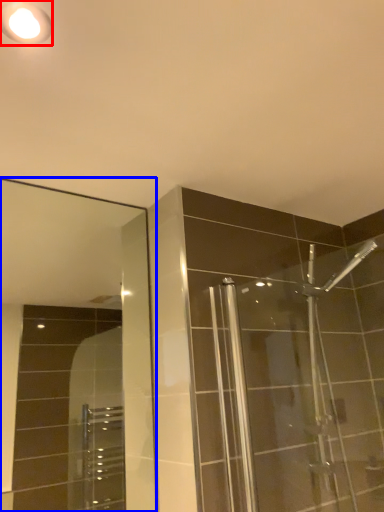
Question: Among these objects, which one is nearest to the camera, light fixture (highlighted by a red box) or mirror (highlighted by a blue box)?

Choices:
 (A) light fixture
 (B) mirror

Answer: (A)